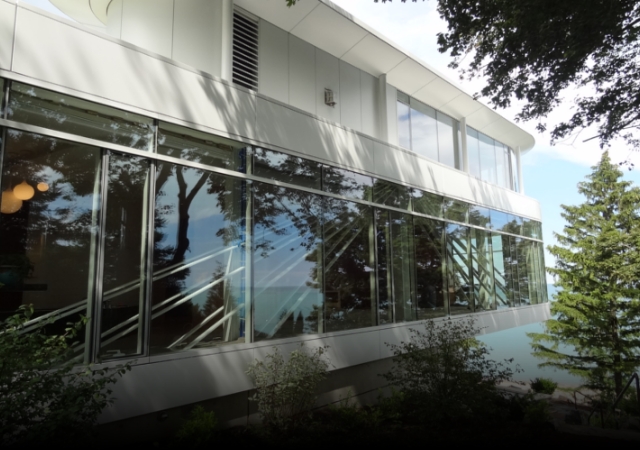
Image resolution: width=640 pixels, height=450 pixels. Find the location of `glass`. glass is located at coordinates (299, 253).